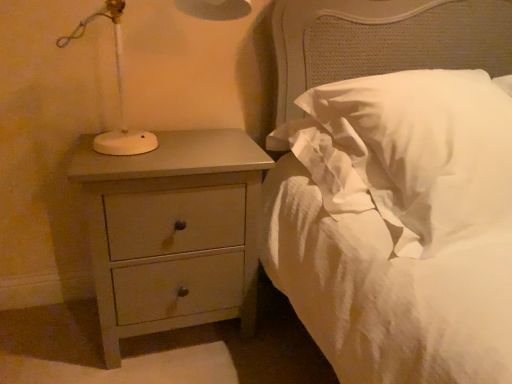
Question: From a real-world perspective, is matte gray chest of drawers at left positioned above or below white soft pillow at upper right?

Choices:
 (A) below
 (B) above

Answer: (A)

Question: Based on their sizes in the image, would you say matte gray chest of drawers at left is bigger or smaller than white soft pillow at upper right?

Choices:
 (A) small
 (B) big

Answer: (A)

Question: Looking at their shapes, would you say matte gray chest of drawers at left is wider or thinner than white soft pillow at upper right?

Choices:
 (A) wide
 (B) thin

Answer: (B)

Question: Is white soft pillow at upper right inside the boundaries of matte gray chest of drawers at left, or outside?

Choices:
 (A) outside
 (B) inside

Answer: (A)

Question: In terms of size, does white soft pillow at upper right appear bigger or smaller than matte gray chest of drawers at left?

Choices:
 (A) big
 (B) small

Answer: (A)

Question: From a real-world perspective, relative to matte gray chest of drawers at left, is white soft pillow at upper right vertically above or below?

Choices:
 (A) above
 (B) below

Answer: (A)

Question: Considering the positions of white soft pillow at upper right and matte gray chest of drawers at left in the image, is white soft pillow at upper right wider or thinner than matte gray chest of drawers at left?

Choices:
 (A) wide
 (B) thin

Answer: (A)